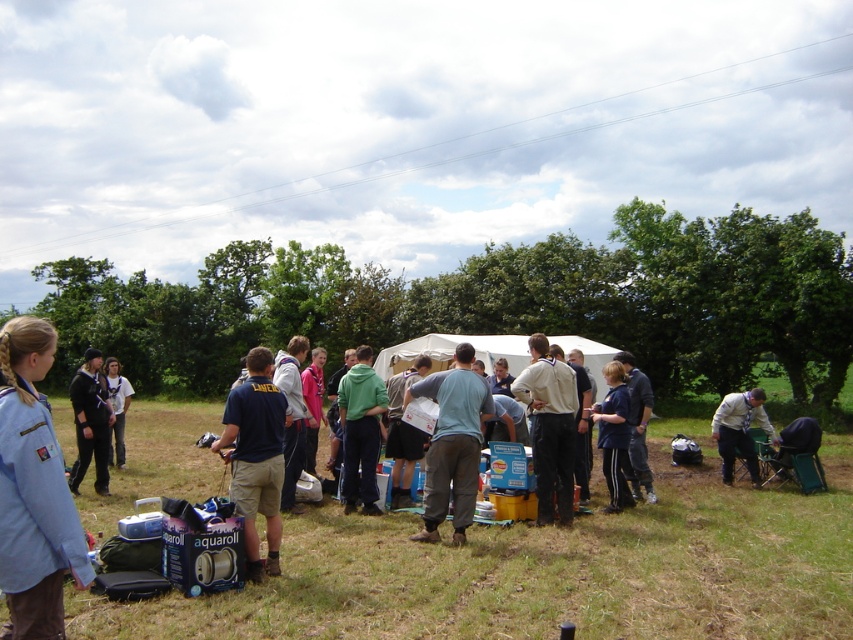
From the picture: What object is located at the coordinates point (546,570) in the image?

The point (546,570) corresponds to the blue plastic cooler at center.